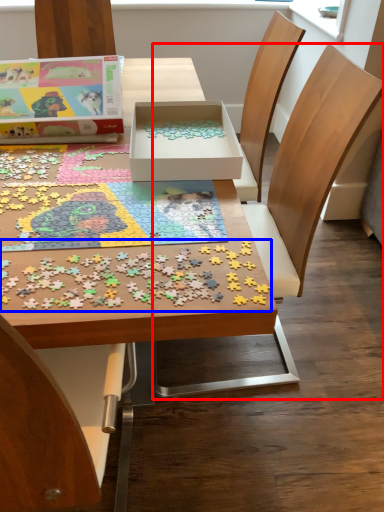
Question: Among these objects, which one is farthest to the camera, chair (highlighted by a red box) or jigsaw puzzle (highlighted by a blue box)?

Choices:
 (A) chair
 (B) jigsaw puzzle

Answer: (A)